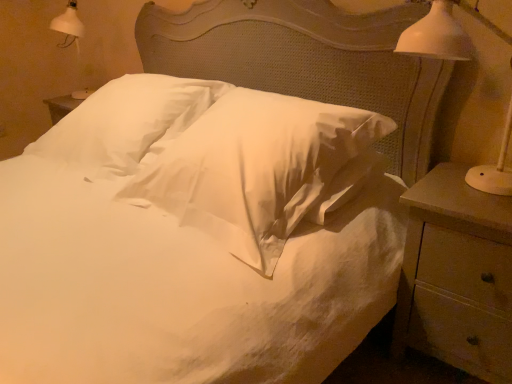
Question: Is wooden nightstand at right at the left side of white ceramic lamp at right?

Choices:
 (A) yes
 (B) no

Answer: (B)

Question: Is wooden nightstand at right far away from white ceramic lamp at right?

Choices:
 (A) yes
 (B) no

Answer: (B)

Question: Does wooden nightstand at right lie behind white ceramic lamp at right?

Choices:
 (A) no
 (B) yes

Answer: (B)

Question: Does wooden nightstand at right lie in front of white ceramic lamp at right?

Choices:
 (A) no
 (B) yes

Answer: (A)

Question: Considering the relative sizes of wooden nightstand at right and white ceramic lamp at right in the image provided, is wooden nightstand at right taller than white ceramic lamp at right?

Choices:
 (A) no
 (B) yes

Answer: (B)

Question: Considering the positions of point (453, 29) and point (309, 142), is point (453, 29) closer or farther from the camera than point (309, 142)?

Choices:
 (A) farther
 (B) closer

Answer: (B)

Question: From a real-world perspective, is white ceramic lamp at right positioned above or below white satin pillow at center, which is counted as the 1th pillow, starting from the right?

Choices:
 (A) below
 (B) above

Answer: (B)

Question: Is white ceramic lamp at right wider or thinner than white satin pillow at center, which is the second pillow in left-to-right order?

Choices:
 (A) thin
 (B) wide

Answer: (A)

Question: From the image's perspective, is white ceramic lamp at right located above or below white satin pillow at center, which is the second pillow in left-to-right order?

Choices:
 (A) below
 (B) above

Answer: (B)

Question: In terms of size, does white ceramic lamp at right appear bigger or smaller than wooden nightstand at right?

Choices:
 (A) big
 (B) small

Answer: (B)

Question: From their relative heights in the image, would you say white ceramic lamp at right is taller or shorter than wooden nightstand at right?

Choices:
 (A) short
 (B) tall

Answer: (A)

Question: From the image's perspective, is white ceramic lamp at right above or below wooden nightstand at right?

Choices:
 (A) below
 (B) above

Answer: (B)

Question: Considering the positions of point (416, 41) and point (453, 167), is point (416, 41) closer or farther from the camera than point (453, 167)?

Choices:
 (A) farther
 (B) closer

Answer: (B)

Question: Relative to white ceramic lamp at right, is white satin pillow at center, which is the second pillow in left-to-right order, in front or behind?

Choices:
 (A) behind
 (B) front

Answer: (A)

Question: In the image, is white satin pillow at center, which is counted as the 1th pillow, starting from the right, on the left side or the right side of white ceramic lamp at right?

Choices:
 (A) right
 (B) left

Answer: (B)